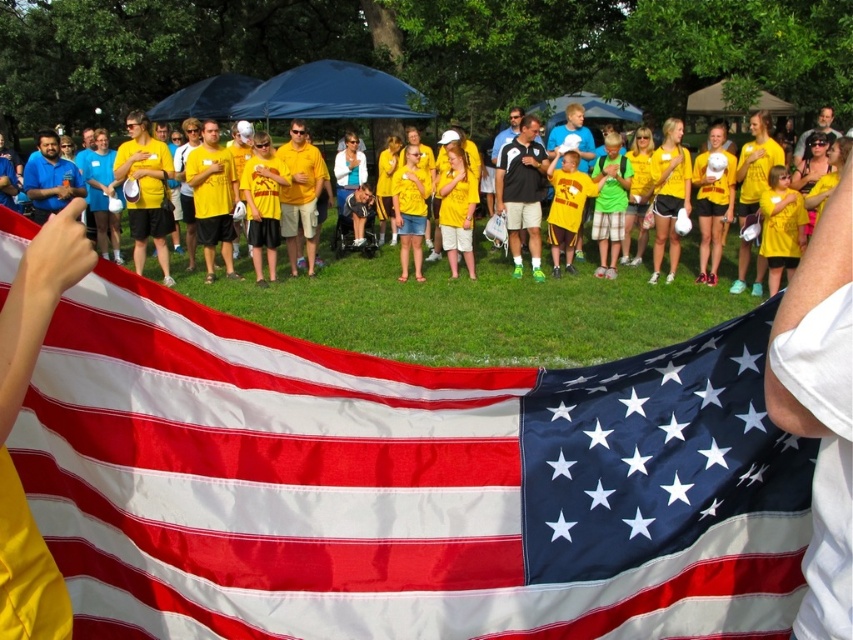
You are a photographer at the event and want to capture a photo where the matte fabric flag at center is taller than the matte yellow shirt at upper right. Is this possible given their current positions?

The matte fabric flag at center is not as tall as the matte yellow shirt at upper right, so it is not possible to capture a photo where the matte fabric flag at center appears taller than the matte yellow shirt at upper right in their current positions.

You are standing at the center of the park where the flag is displayed. There is a point marked at coordinates [403,483]. Based on the scene description, can you determine what object this point is located on?

The point at coordinates [403,483] is located on the matte fabric flag at center, as stated in the object description.